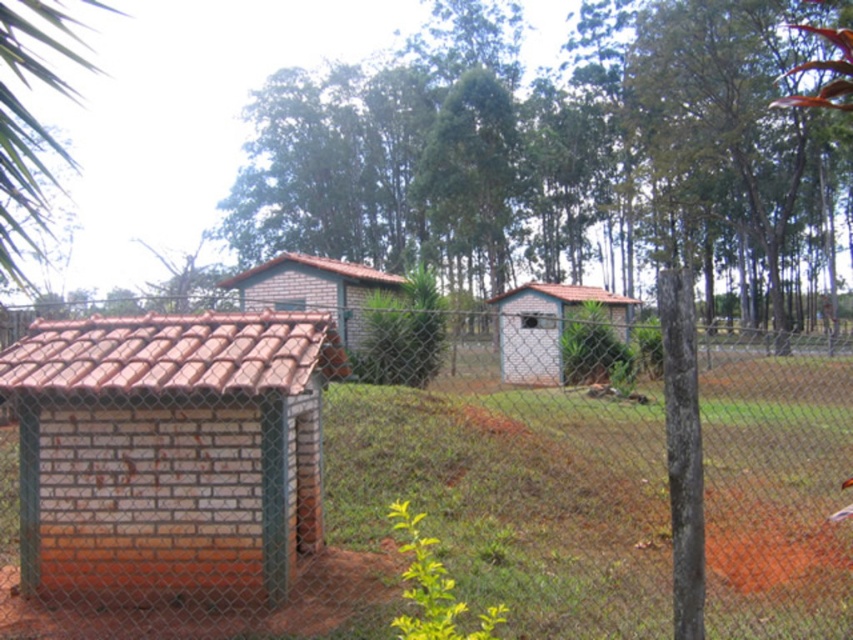
Question: Which point is farther to the camera?

Choices:
 (A) (374, 490)
 (B) (338, 332)

Answer: (B)

Question: Estimate the real-world distances between objects in this image. Which object is closer to the white brick hut at center?

Choices:
 (A) brick/tile hut at left
 (B) brown brick hut at center

Answer: (B)

Question: In this image, where is brick/tile hut at left located relative to white brick hut at center?

Choices:
 (A) above
 (B) below

Answer: (B)

Question: Where is brick/tile hut at left located in relation to white brick hut at center in the image?

Choices:
 (A) above
 (B) below

Answer: (B)

Question: Can you confirm if brick/tile hut at left is thinner than white brick hut at center?

Choices:
 (A) no
 (B) yes

Answer: (B)

Question: Which object appears closest to the camera in this image?

Choices:
 (A) brick/tile hut at left
 (B) chain link fence at center

Answer: (B)